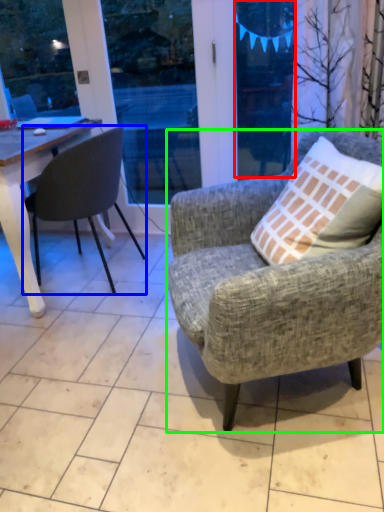
Question: Which is nearer to the window screen (highlighted by a red box)? chair (highlighted by a blue box) or chair (highlighted by a green box).

Choices:
 (A) chair
 (B) chair

Answer: (A)